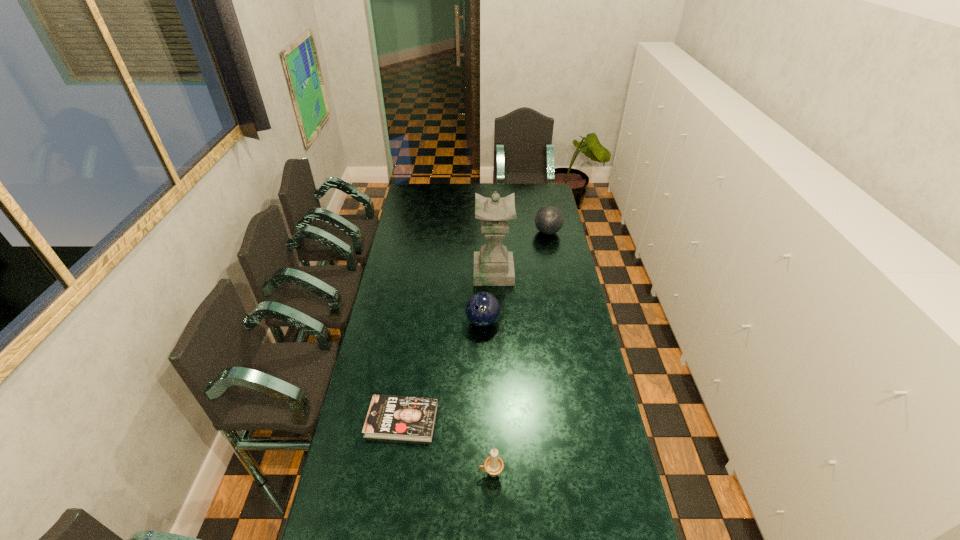
Find the location of a particular element. This screenshot has height=540, width=960. object located at the left edge is located at coordinates (x=403, y=418).

Identify the location of object located in the right edge section of the desktop. The height and width of the screenshot is (540, 960). (548, 220).

Where is `vacant space at the far edge of the desktop`? vacant space at the far edge of the desktop is located at coordinates (456, 199).

Image resolution: width=960 pixels, height=540 pixels. In the image, there is a desktop. Find the location of `free space at the left edge`. free space at the left edge is located at coordinates (378, 315).

Where is `vacant point at the right edge`? This screenshot has height=540, width=960. vacant point at the right edge is located at coordinates (577, 395).

You are a GUI agent. You are given a task and a screenshot of the screen. Output one action in this format:
    pyautogui.click(x=<x>, y=<y>)
    Task: Click on the free space at the far right corner
    This screenshot has width=960, height=540.
    Given the screenshot: What is the action you would take?
    pyautogui.click(x=527, y=186)

Locate an element on the screen. free space between the candle_holder and the second nearest object is located at coordinates (446, 447).

At what (x,y) coordinates should I click in order to perform the action: click on blank region between the shortest object and the candle_holder. Please return your answer as a coordinate pair (x, y). Looking at the image, I should click on (446, 447).

You are a GUI agent. You are given a task and a screenshot of the screen. Output one action in this format:
    pyautogui.click(x=<x>, y=<y>)
    Task: Click on the vacant space in between the second nearest object and the nearer bowling ball
    
    Given the screenshot: What is the action you would take?
    pyautogui.click(x=443, y=371)

You are a GUI agent. You are given a task and a screenshot of the screen. Output one action in this format:
    pyautogui.click(x=<x>, y=<y>)
    Task: Click on the vacant point located between the left bowling ball and the rightmost object
    This screenshot has height=540, width=960.
    Given the screenshot: What is the action you would take?
    pyautogui.click(x=516, y=277)